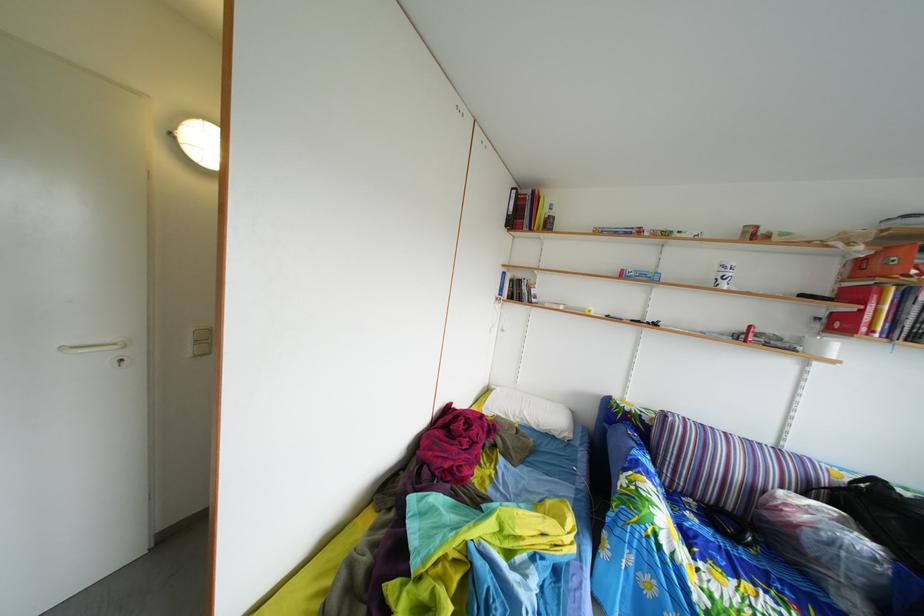
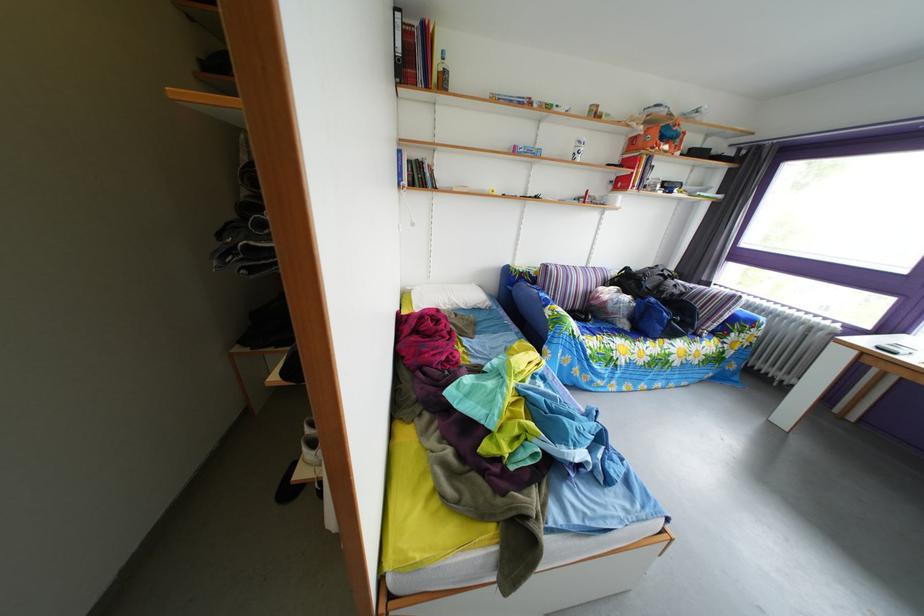
In the second image, find the point that corresponds to point (792, 447) in the first image.

(599, 270)